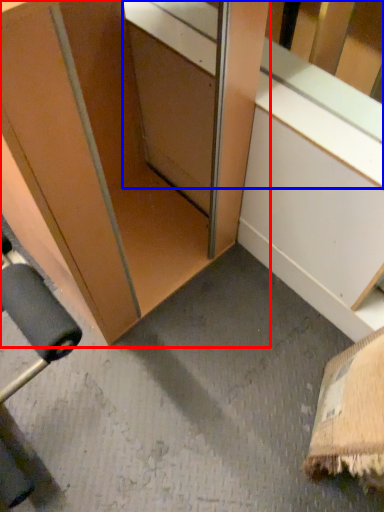
Question: Which point is further to the camera, cabinetry (highlighted by a red box) or window sill (highlighted by a blue box)?

Choices:
 (A) cabinetry
 (B) window sill

Answer: (B)